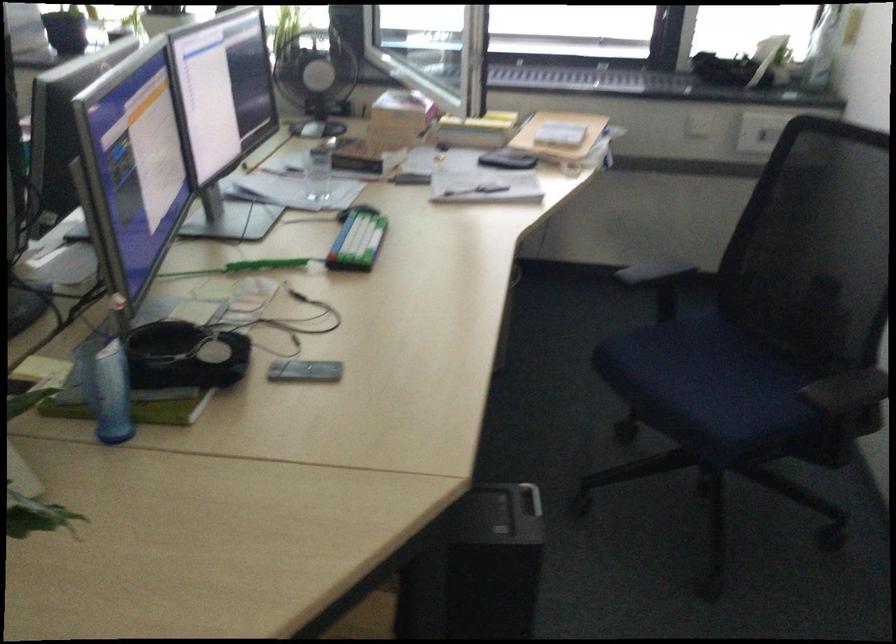
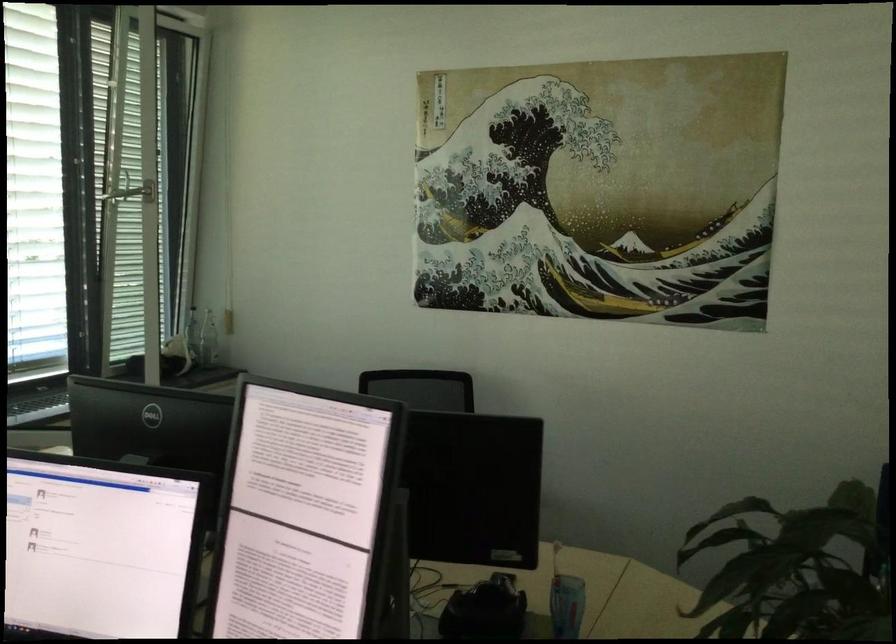
Question: I am providing you with two images of the same scene from different viewpoints. After the viewpoint changes to image2, which objects are now occluded?

Choices:
 (A) blue power switch
 (B) silver door handle
 (C) blue chair sitting surface
 (D) blue patterned cup

Answer: (C)